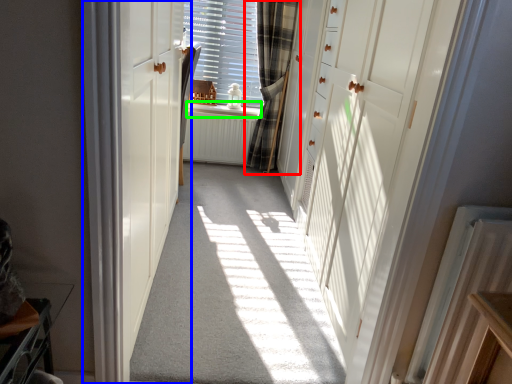
Question: Considering the real-world distances, which object is farthest from curtain (highlighted by a red box)? door (highlighted by a blue box) or window sill (highlighted by a green box)?

Choices:
 (A) door
 (B) window sill

Answer: (A)